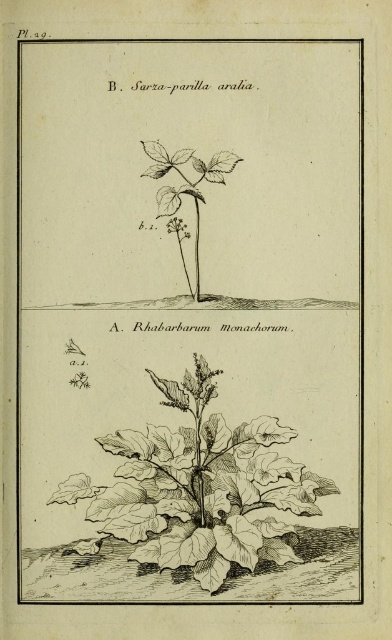
Based on the botanical illustration provided, which plant has a wider base? The brown textured plant at lower center or the green leafy plant at center?

The brown textured plant at lower center is wider than the green leafy plant at center according to the description.

You are a botanist examining the botanical illustration. You need to place a ruler between the brown textured plant at lower center and the green leafy plant at center. How far apart are these two plants in the illustration?

The brown textured plant at lower center and the green leafy plant at center are 11.68 inches apart.

In the botanical illustration, you are examining the two plants labeled B. Sarza_parilla aralia and A. Rhabarbarum monachorum. Where exactly is the brown textured plant at lower center located in terms of coordinates?

The brown textured plant at lower center is located at coordinates point (199, 490).